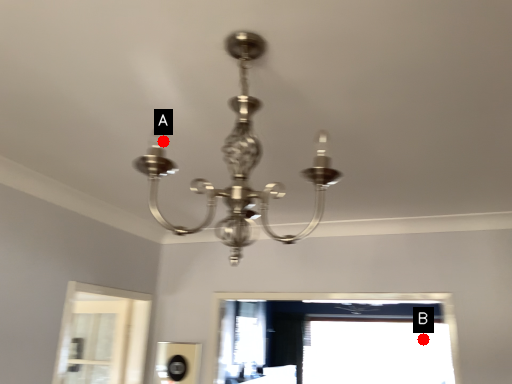
Question: Two points are circled on the image, labeled by A and B beside each circle. Which point appears closest to the camera in this image?

Choices:
 (A) A is closer
 (B) B is closer

Answer: (A)